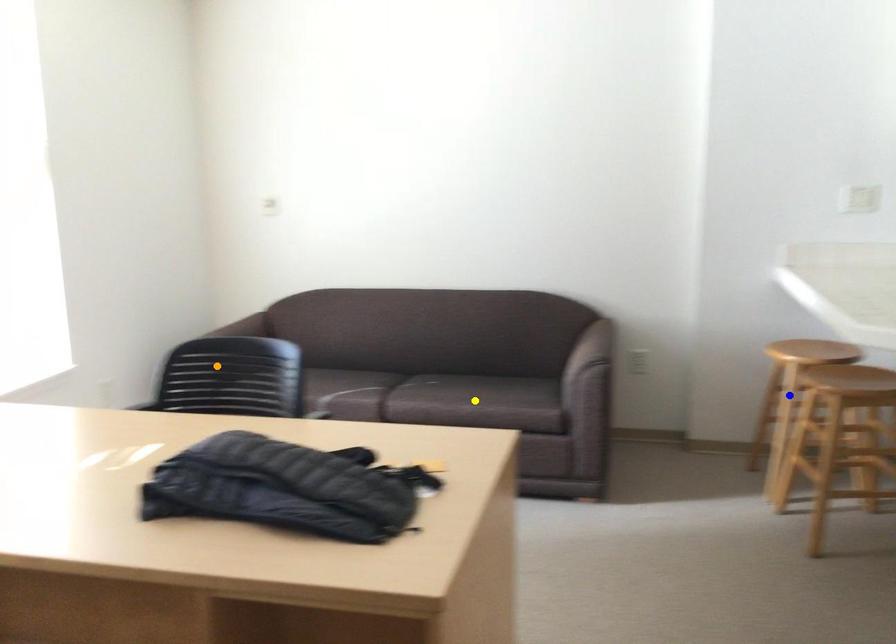
Order these from nearest to farthest:
orange point
blue point
yellow point

orange point < blue point < yellow point